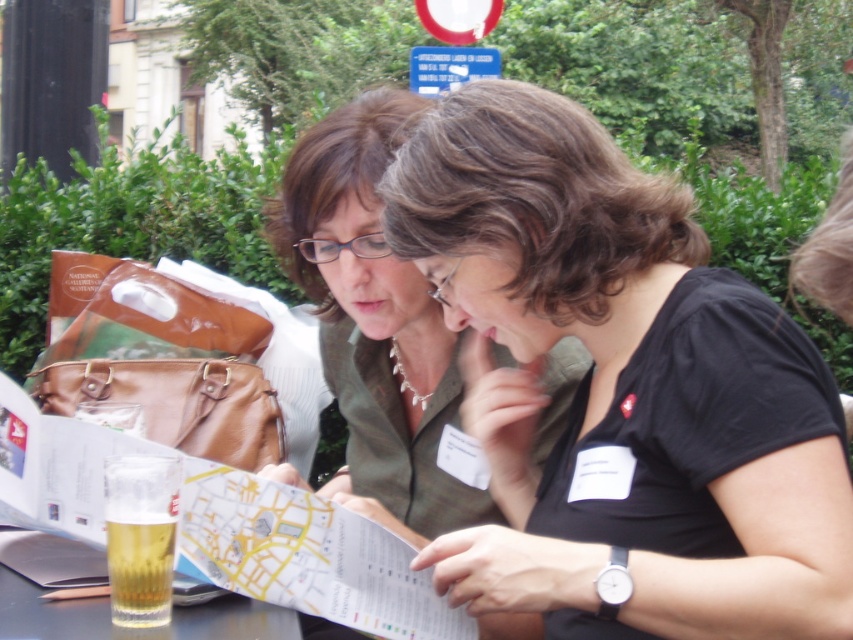
Question: Does green matte shirt at center have a larger size compared to translucent glass at lower left?

Choices:
 (A) yes
 (B) no

Answer: (A)

Question: Is black matte shirt at center smaller than green matte shirt at center?

Choices:
 (A) no
 (B) yes

Answer: (B)

Question: Which point is closer to the camera?

Choices:
 (A) black matte shirt at center
 (B) translucent glass beer at lower left
 (C) translucent glass at lower left

Answer: (A)

Question: Is black matte shirt at center to the right of green matte shirt at center from the viewer's perspective?

Choices:
 (A) no
 (B) yes

Answer: (B)

Question: Estimate the real-world distances between objects in this image. Which object is farther from the translucent glass at lower left?

Choices:
 (A) translucent glass beer at lower left
 (B) black matte shirt at center
 (C) green matte shirt at center

Answer: (B)

Question: Which object appears farthest from the camera in this image?

Choices:
 (A) translucent glass beer at lower left
 (B) green matte shirt at center
 (C) black matte shirt at center

Answer: (B)